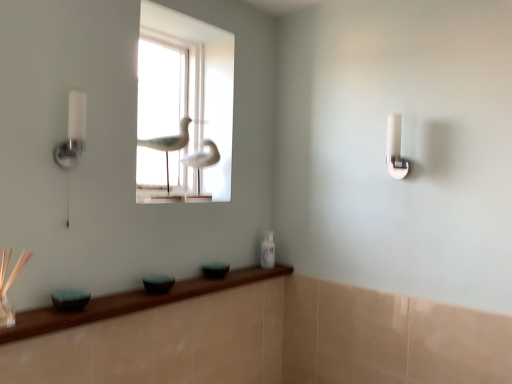
Question: Considering the positions of point (165, 84) and point (272, 249), is point (165, 84) closer or farther from the camera than point (272, 249)?

Choices:
 (A) closer
 (B) farther

Answer: (B)

Question: Considering the positions of transparent glass door at center and white glossy bottle at lower center in the image, is transparent glass door at center taller or shorter than white glossy bottle at lower center?

Choices:
 (A) short
 (B) tall

Answer: (B)

Question: Which of these objects is positioned farthest from the white plastic light switch at upper right?

Choices:
 (A) white glossy bird at center, placed as the first bird when sorted from front to back
 (B) transparent glass door at center
 (C) white glossy wall sconce at left
 (D) white glossy bottle at lower center
 (E) green glass bowl at lower center, which is the 1th glass bowl from right to left

Answer: (B)

Question: Estimate the real-world distances between objects in this image. Which object is closer to the white glossy bird at center, placed as the first bird when sorted from front to back?

Choices:
 (A) transparent glass door at center
 (B) matte teal glass bowl at lower center, placed as the second glass bowl when sorted from left to right
 (C) white plastic light switch at upper right
 (D) white matte bird at center, which is the 1th bird in back-to-front order
 (E) white glossy wall sconce at left

Answer: (D)